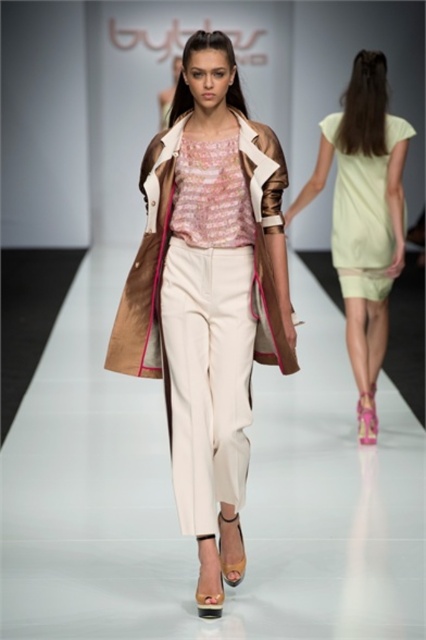
You are a photographer at the runway show. You want to capture a photo where both the metallic gold coat at center and the light yellow fabric dress at back are clearly visible. Based on their positions, which one should you focus on first to ensure both are in frame?

The metallic gold coat at center is positioned under the light yellow fabric dress at back, so focusing on the metallic gold coat at center first will ensure both are in frame as the dress is behind it.

You are a photographer at the runway show. You want to capture a photo that includes both the metallic gold coat at center and the light yellow fabric dress at back. Based on their positions, which object should you adjust your camera to focus on first to ensure both are in the frame?

The metallic gold coat at center is to the left of light yellow fabric dress at back, so you should focus on the light yellow fabric dress at back first to ensure both are in the frame.

Where is the metallic gold coat at center located in the runway scene?

The metallic gold coat at center is located at point coordinates of (209, 296).